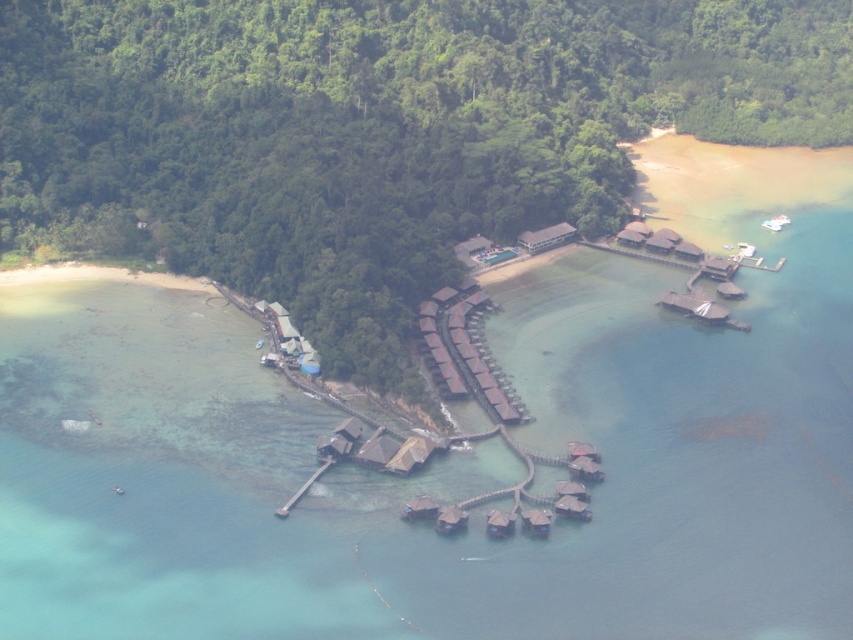
Does brown wooden hut at center have a lesser height compared to wooden dock at lower center?

Indeed, brown wooden hut at center has a lesser height compared to wooden dock at lower center.

Does point (532, 241) lie behind point (288, 512)?

Yes, point (532, 241) is farther from viewer.

Identify the location of brown wooden hut at center. Image resolution: width=853 pixels, height=640 pixels. (546, 237).